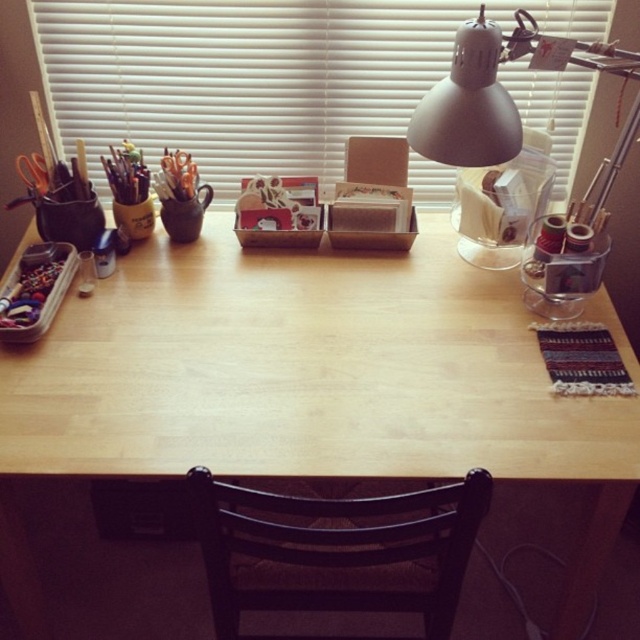
Between wooden table at center and white matte blinds at upper center, which one has more height?

With more height is wooden table at center.

Does wooden table at center have a lesser width compared to white matte blinds at upper center?

No.

Does point (72, 470) lie behind point (323, 131)?

No, it is not.

At what (x,y) coordinates should I click in order to perform the action: click on wooden table at center. Please return your answer as a coordinate pair (x, y). Looking at the image, I should click on (304, 387).

Which of these two, white matte blinds at upper center or brown wooden chair at lower center, stands shorter?

white matte blinds at upper center is shorter.

Who is more forward, [464,13] or [298,522]?

Point [298,522]

This screenshot has width=640, height=640. I want to click on white matte blinds at upper center, so click(x=257, y=74).

Consider the image. Who is higher up, wooden table at center or brown wooden chair at lower center?

Positioned higher is wooden table at center.

Between wooden table at center and brown wooden chair at lower center, which one is positioned lower?

Positioned lower is brown wooden chair at lower center.

At what (x,y) coordinates should I click in order to perform the action: click on wooden table at center. Please return your answer as a coordinate pair (x, y). The image size is (640, 640). Looking at the image, I should click on pos(304,387).